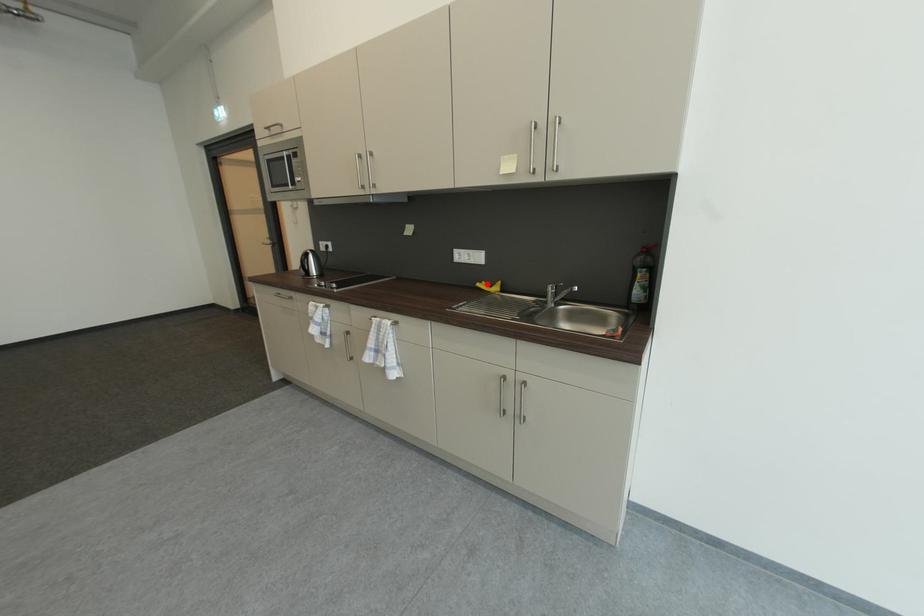
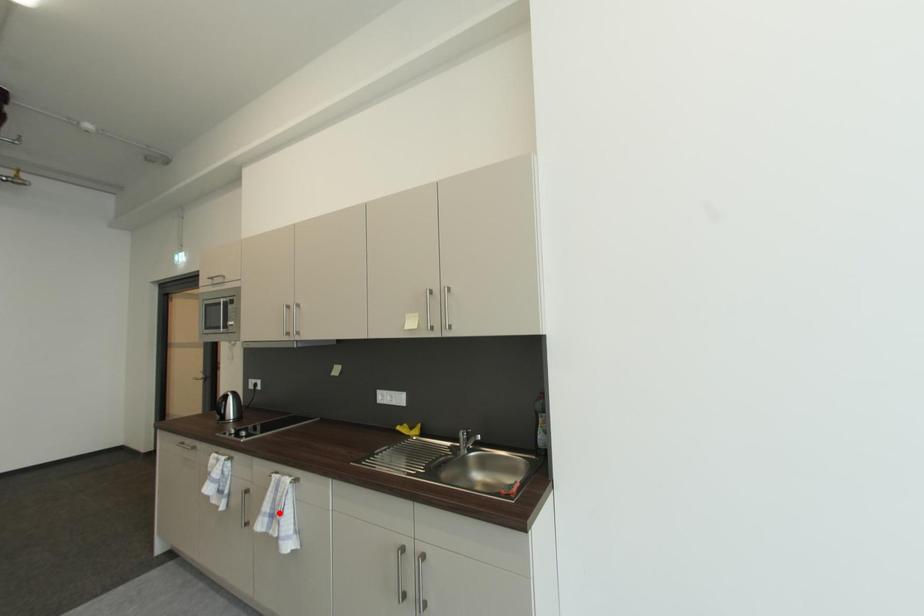
I am providing you with two images of the same scene from different viewpoints. A red point is marked on the first image and another point is marked on the second image. Does the point marked in image1 correspond to the same location as the one in image2?

No